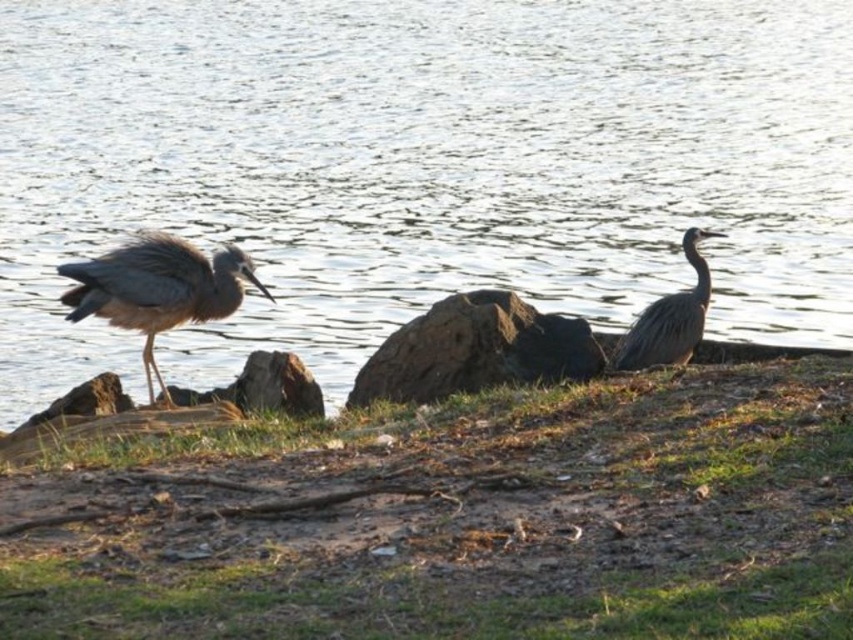
You are a photographer trying to capture the birds in the scene. You want to ensure your camera is focused on the green grass at lower center. What coordinates should you use to adjust your camera focus?

The green grass at lower center is located at coordinates (460, 518), so you should adjust your camera focus to those coordinates.

You are a photographer setting up a tripod to capture the two birds in the lakeside scene. The green grass at lower center and the brown rough rock at center are in your view. Which object is shorter in height?

The green grass at lower center is shorter than the brown rough rock at center.

You are a photographer aiming to capture the gray matte heron at left and the brown rough rock at center in your shot. Based on their positions and sizes, which object appears taller in the image?

The gray matte heron at left appears taller than the brown rough rock at center in the image.